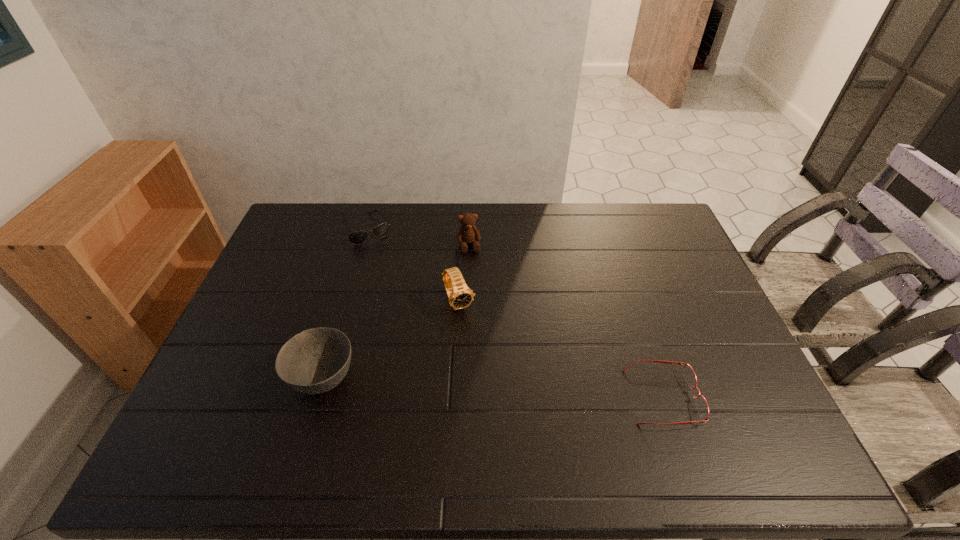
Identify the location of free space on the desktop that is between the bowl and the shortest object and is positioned on the face of the teddy bear. (497, 388).

Locate an element on the screen. The width and height of the screenshot is (960, 540). free spot on the desktop that is between the bowl and the rightmost object and is positioned on the face of the third farthest object is located at coordinates (504, 388).

This screenshot has width=960, height=540. Find the location of `vacant space on the desktop that is between the bowl and the shortest object and is positioned on the front-facing side of the sunglasses`. vacant space on the desktop that is between the bowl and the shortest object and is positioned on the front-facing side of the sunglasses is located at coordinates (460, 386).